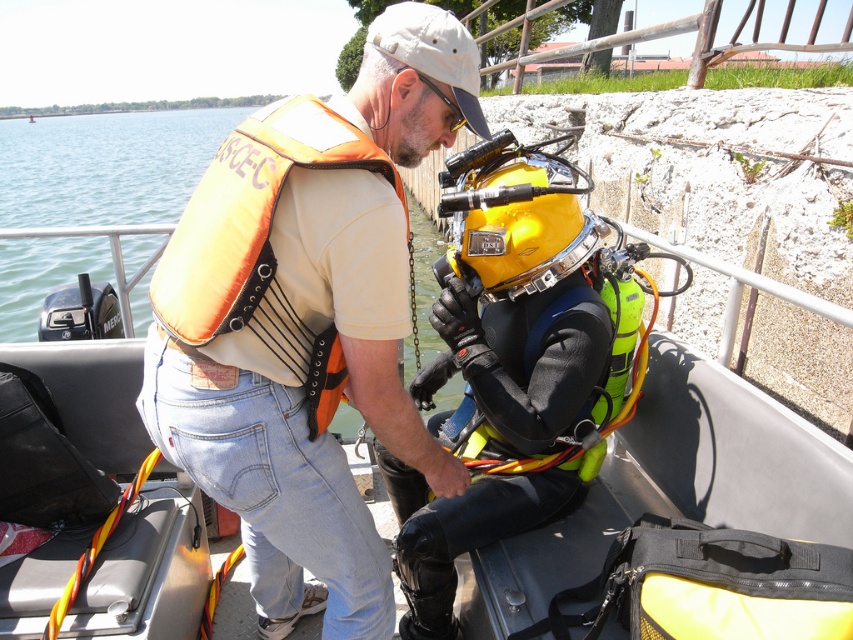
Question: Does orange fabric life vest at center have a larger size compared to metallic gray boat at center?

Choices:
 (A) yes
 (B) no

Answer: (A)

Question: Estimate the real-world distances between objects in this image. Which object is closer to the yellow matte helmet at center?

Choices:
 (A) orange fabric life vest at center
 (B) metallic gray boat at center
 (C) orange life vest at left

Answer: (A)

Question: Which point is farther to the camera?

Choices:
 (A) (670, 385)
 (B) (323, 634)
 (C) (13, 195)

Answer: (C)

Question: Observing the image, what is the correct spatial positioning of yellow matte helmet at center in reference to orange fabric life jacket at upper left?

Choices:
 (A) above
 (B) below

Answer: (B)

Question: Is orange fabric life jacket at upper left to the left of orange life vest at left from the viewer's perspective?

Choices:
 (A) yes
 (B) no

Answer: (B)

Question: Which object appears closest to the camera in this image?

Choices:
 (A) orange life vest at left
 (B) yellow matte helmet at center
 (C) orange fabric life vest at center

Answer: (C)